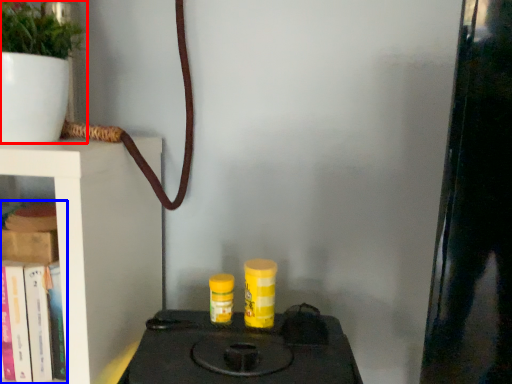
Question: Which object is further to the camera taking this photo, houseplant (highlighted by a red box) or book (highlighted by a blue box)?

Choices:
 (A) houseplant
 (B) book

Answer: (B)